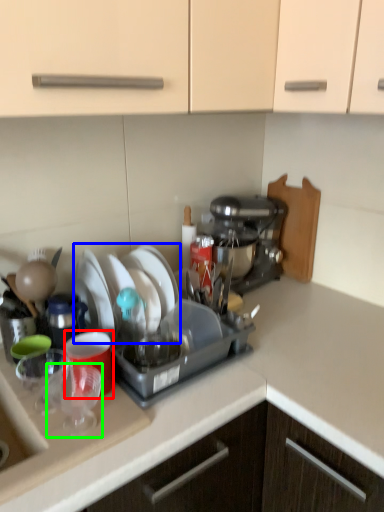
Question: Which object is the farthest from coffee cup (highlighted by a red box)? Choose among these: tableware (highlighted by a blue box) or tableware (highlighted by a green box).

Choices:
 (A) tableware
 (B) tableware

Answer: (A)